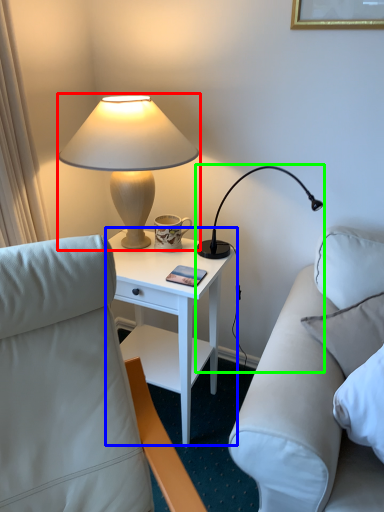
Question: Which object is the farthest from lamp (highlighted by a red box)? Choose among these: nightstand (highlighted by a blue box) or lamp (highlighted by a green box).

Choices:
 (A) nightstand
 (B) lamp

Answer: (B)